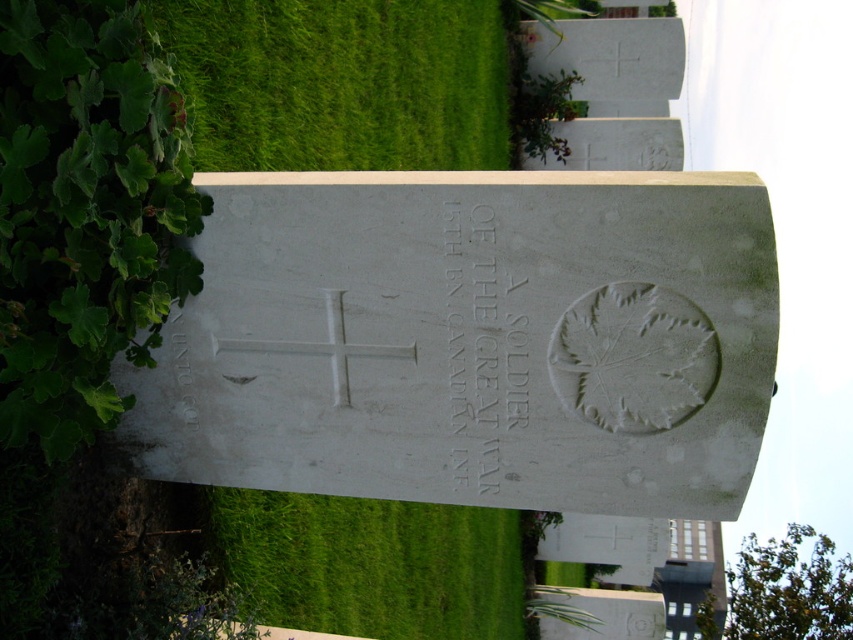
You are standing in front of the gravestone and want to touch both the cross and the maple leaf. Which symbol should you reach for first, the one at point (460,104) or the one at point (519,356)?

The point at (460,104) is closer to you, so you should reach for the symbol at that point first.

You are standing in front of the gravestone and want to place a wreath on the green grass at upper left. Based on the coordinates provided in the description, can you determine the exact position to place it?

The green grass at upper left is located at point (341, 83), so you should place the wreath at those coordinates.

You are standing in front of the gravestone and want to place a wreath on the part of the stone that has more space. Which part should you choose between the white stone inscription at center and the green leafy hedge at upper center?

The white stone inscription at center has a lesser width compared to the green leafy hedge at upper center, so the green leafy hedge at upper center has more space and is the better choice for placing the wreath.